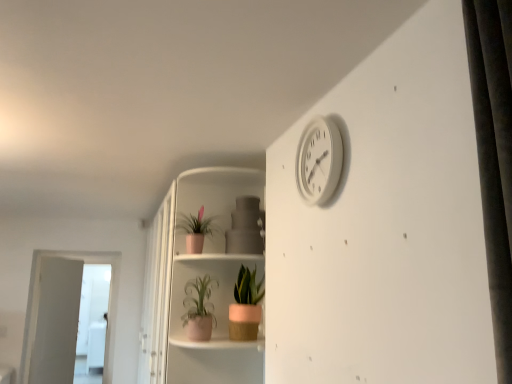
Question: Considering the relative positions of matte white shelf at center and matte pink pot at lower center, arranged as the 2th houseplant when viewed from the left, in the image provided, is matte white shelf at center behind matte pink pot at lower center, arranged as the 2th houseplant when viewed from the left,?

Choices:
 (A) no
 (B) yes

Answer: (A)

Question: Can we say matte white shelf at center lies outside matte pink pot at lower center, acting as the 2th houseplant starting from the right?

Choices:
 (A) no
 (B) yes

Answer: (B)

Question: From a real-world perspective, does matte white shelf at center sit lower than matte pink pot at lower center, arranged as the 2th houseplant when viewed from the left?

Choices:
 (A) yes
 (B) no

Answer: (B)

Question: Considering the relative positions of matte white shelf at center and matte pink pot at lower center, acting as the 2th houseplant starting from the right, in the image provided, is matte white shelf at center to the left of matte pink pot at lower center, acting as the 2th houseplant starting from the right, from the viewer's perspective?

Choices:
 (A) no
 (B) yes

Answer: (A)

Question: Considering the relative sizes of matte white shelf at center and matte pink pot at lower center, arranged as the 2th houseplant when viewed from the left, in the image provided, is matte white shelf at center thinner than matte pink pot at lower center, arranged as the 2th houseplant when viewed from the left,?

Choices:
 (A) yes
 (B) no

Answer: (B)

Question: Is matte white shelf at center oriented away from matte pink pot at lower center, arranged as the 2th houseplant when viewed from the left?

Choices:
 (A) no
 (B) yes

Answer: (B)

Question: From a real-world perspective, is pink matte pot at lower center, positioned as the first houseplant in right-to-left order, physically above white glossy screen door at left, which is counted as the 1th screen door, starting from the right?

Choices:
 (A) no
 (B) yes

Answer: (B)

Question: Could white glossy screen door at left, which is counted as the 1th screen door, starting from the right, be considered to be inside pink matte pot at lower center, positioned as the first houseplant in right-to-left order?

Choices:
 (A) no
 (B) yes

Answer: (A)

Question: Considering the relative sizes of pink matte pot at lower center, positioned as the first houseplant in right-to-left order, and white glossy screen door at left, the second screen door when ordered from back to front, in the image provided, is pink matte pot at lower center, positioned as the first houseplant in right-to-left order, smaller than white glossy screen door at left, the second screen door when ordered from back to front,?

Choices:
 (A) yes
 (B) no

Answer: (A)

Question: Considering the relative sizes of pink matte pot at lower center, placed as the third houseplant when sorted from left to right, and white glossy screen door at left, which appears as the 2th screen door when viewed from the left, in the image provided, is pink matte pot at lower center, placed as the third houseplant when sorted from left to right, wider than white glossy screen door at left, which appears as the 2th screen door when viewed from the left,?

Choices:
 (A) yes
 (B) no

Answer: (A)

Question: Can you confirm if pink matte pot at lower center, positioned as the first houseplant in right-to-left order, is positioned to the left of white glossy screen door at left, the second screen door when ordered from back to front?

Choices:
 (A) no
 (B) yes

Answer: (A)

Question: From a real-world perspective, is pink matte pot at lower center, placed as the third houseplant when sorted from left to right, positioned under white glossy screen door at left, which appears as the 2th screen door when viewed from the left, based on gravity?

Choices:
 (A) yes
 (B) no

Answer: (B)

Question: Is white glossy screen door at left, which appears as the 2th screen door when viewed from the left, placed right next to white plastic clock at upper right?

Choices:
 (A) no
 (B) yes

Answer: (A)